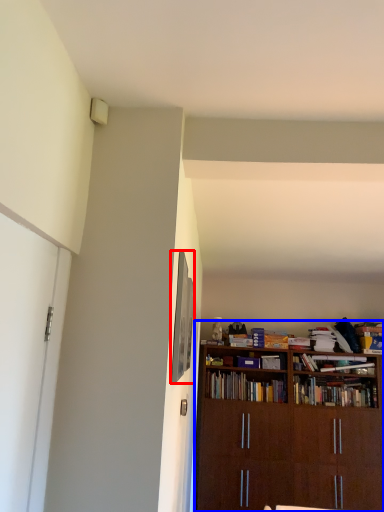
Question: Which object is further to the camera taking this photo, picture frame (highlighted by a red box) or bookcase (highlighted by a blue box)?

Choices:
 (A) picture frame
 (B) bookcase

Answer: (B)